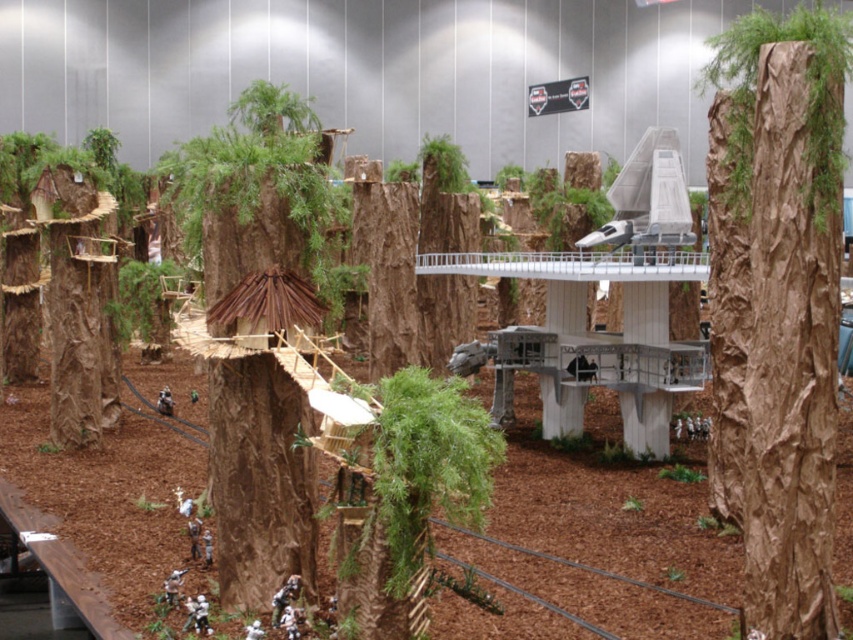
You are a small creature navigating through the forest diorama. You need to climb up the brown textured bark at center and the brown textured tree trunk at center. Which one would be taller for you to climb?

The brown textured bark at center is taller than the brown textured tree trunk at center, so it would be the taller one for you to climb.